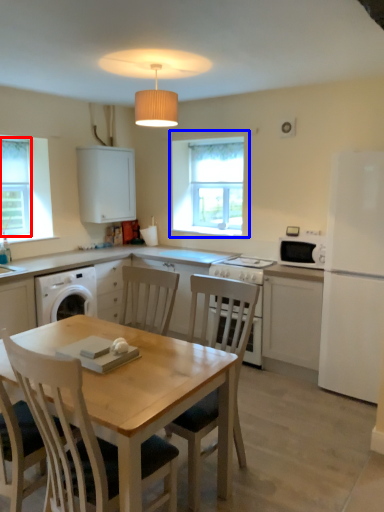
Question: Which object is further to the camera taking this photo, window screen (highlighted by a red box) or window (highlighted by a blue box)?

Choices:
 (A) window screen
 (B) window

Answer: (B)